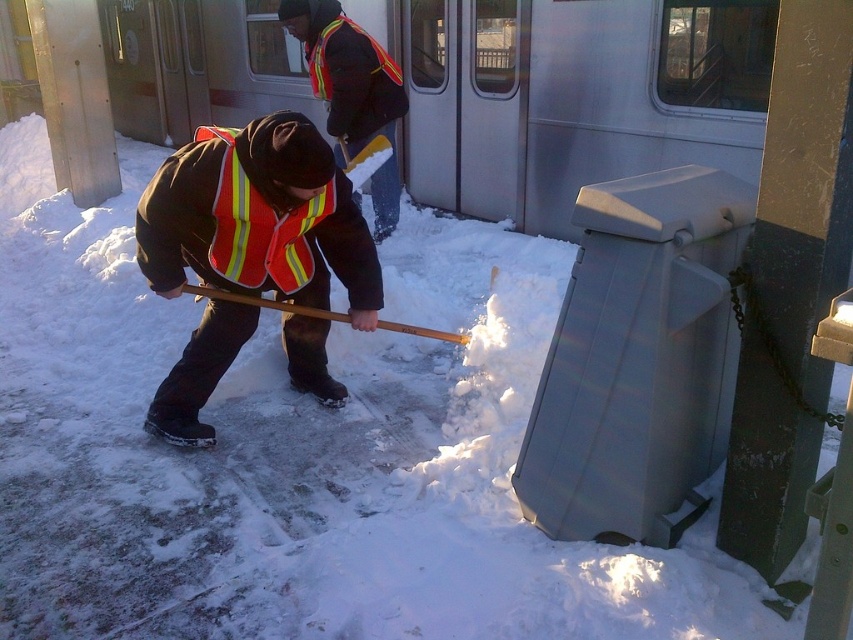
You are a photographer standing at the train station platform. You want to take a photo of the reflective orange safety vest at center so that it appears clearly in the foreground. Given that the vest is 2.48 meters away from you, what should you adjust in your camera settings to ensure the vest is in focus?

To ensure the reflective orange safety vest at center appears clearly in focus, set your camera focus point to 2.48 meters since the vest is exactly that distance away from the camera.